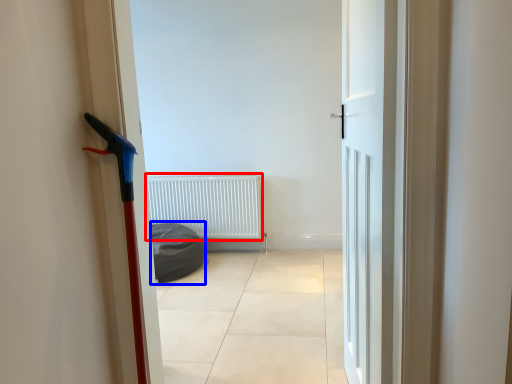
Question: Which of the following is the closest to the observer, radiator (highlighted by a red box) or sleeping bag (highlighted by a blue box)?

Choices:
 (A) radiator
 (B) sleeping bag

Answer: (B)